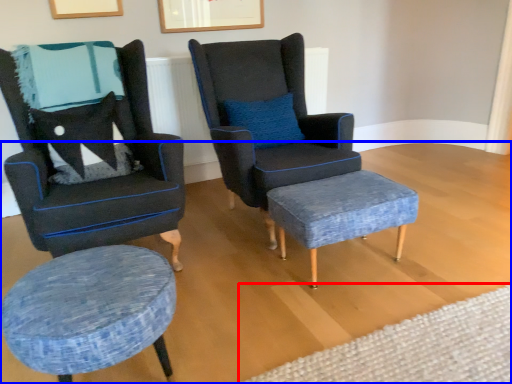
Question: Which of the following is the farthest to the observer, plain (highlighted by a red box) or plain (highlighted by a blue box)?

Choices:
 (A) plain
 (B) plain

Answer: (A)